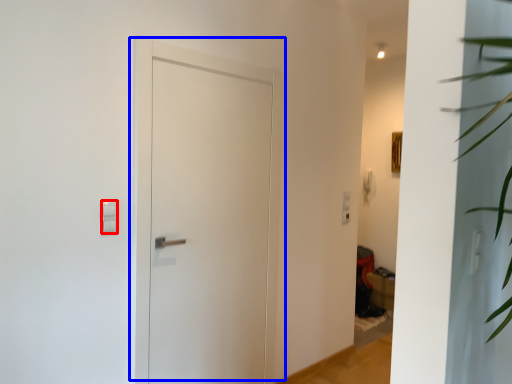
Question: Among these objects, which one is nearest to the camera, light switch (highlighted by a red box) or door (highlighted by a blue box)?

Choices:
 (A) light switch
 (B) door

Answer: (A)